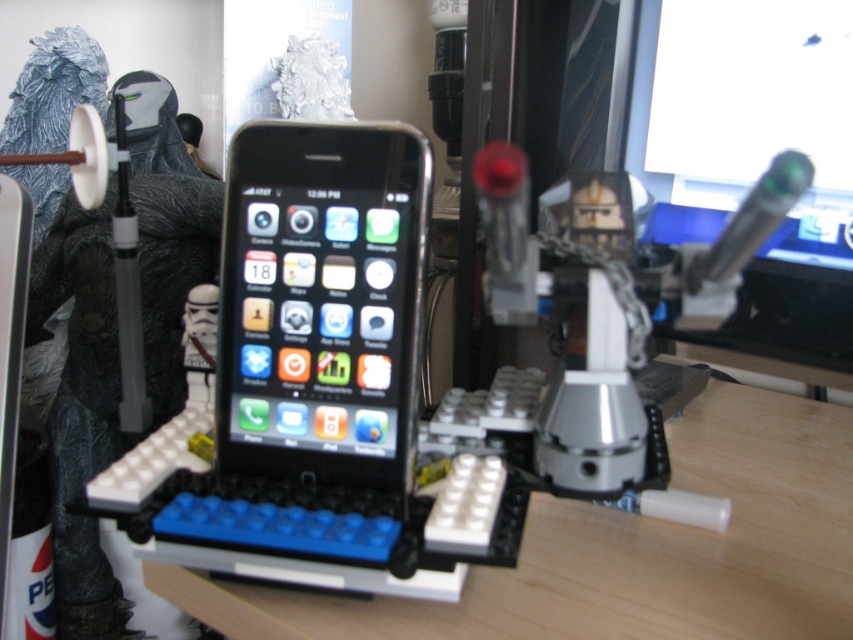
Can you confirm if wooden table at center is taller than black glossy smartphone at center?

In fact, wooden table at center may be shorter than black glossy smartphone at center.

At what (x,y) coordinates should I click in order to perform the action: click on wooden table at center. Please return your answer as a coordinate pair (x, y). Looking at the image, I should click on (625, 552).

Who is positioned more to the right, wooden table at center or matte black monitor at upper right?

Positioned to the right is matte black monitor at upper right.

Can you confirm if wooden table at center is bigger than matte black monitor at upper right?

Correct, wooden table at center is larger in size than matte black monitor at upper right.

The height and width of the screenshot is (640, 853). Describe the element at coordinates (625, 552) in the screenshot. I see `wooden table at center` at that location.

This screenshot has width=853, height=640. In order to click on wooden table at center in this screenshot , I will do `click(625, 552)`.

From the picture: Between black glossy smartphone at center and matte black monitor at upper right, which one appears on the left side from the viewer's perspective?

black glossy smartphone at center

Does black glossy smartphone at center have a lesser width compared to matte black monitor at upper right?

Yes, black glossy smartphone at center is thinner than matte black monitor at upper right.

The height and width of the screenshot is (640, 853). Find the location of `black glossy smartphone at center`. black glossy smartphone at center is located at coordinates (321, 301).